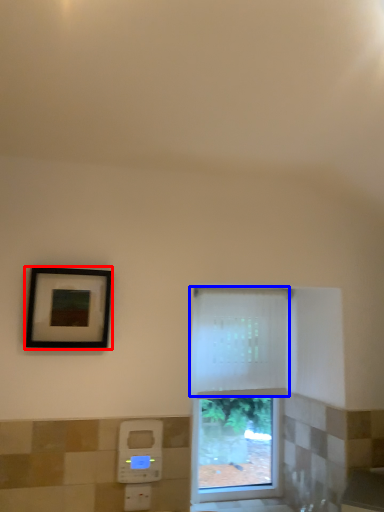
Question: Which object appears closest to the camera in this image, picture frame (highlighted by a red box) or curtain (highlighted by a blue box)?

Choices:
 (A) picture frame
 (B) curtain

Answer: (A)